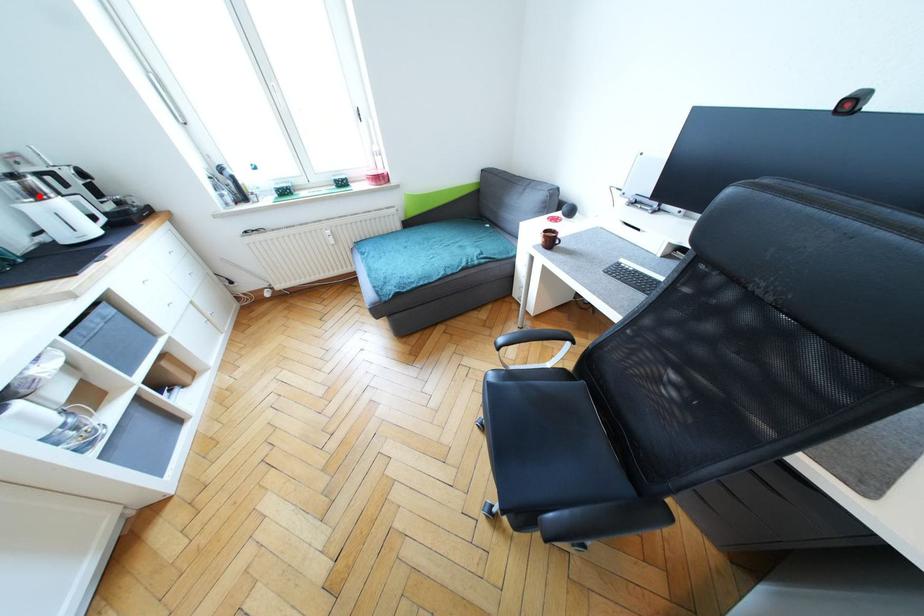
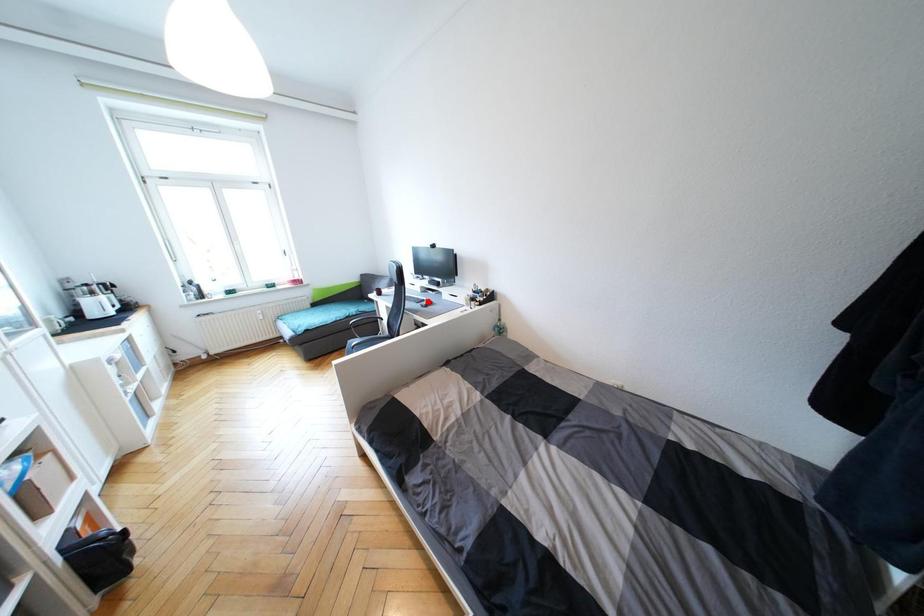
I am providing you with two images of the same scene from different viewpoints. A red point is marked on the first image and another point is marked on the second image. Do the highlighted points in image1 and image2 indicate the same real-world spot?

No